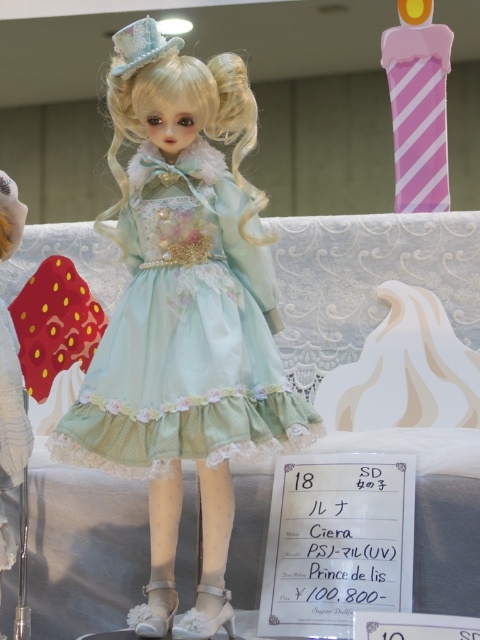
You are an interior designer planning to place a new sofa in a room. The existing sofa has the satin light blue dress at center positioned on it. Where should you place the new sofa so that it aligns with the existing one?

The existing sofa has the satin light blue dress at center positioned at point 2D location at point (186, 333). Therefore, the new sofa should be placed at the same coordinates to maintain alignment.

You are an interior designer arranging a living room. You have a doll wearing a white lace dress at left and a pink striped candle at upper right. Which object is placed higher in the scene?

The pink striped candle at upper right is positioned higher than the white lace dress at left.